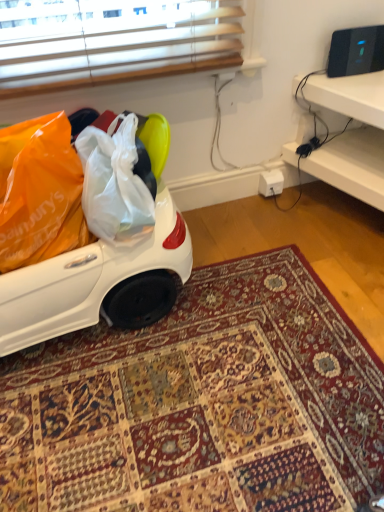
Question: Should I look upward or downward to see carpeted rug at center?

Choices:
 (A) down
 (B) up

Answer: (A)

Question: Does carpeted rug at center lie in front of white plastic desk at right?

Choices:
 (A) yes
 (B) no

Answer: (A)

Question: Is carpeted rug at center in contact with white plastic desk at right?

Choices:
 (A) no
 (B) yes

Answer: (A)

Question: Is there a large distance between carpeted rug at center and white plastic desk at right?

Choices:
 (A) yes
 (B) no

Answer: (B)

Question: Is carpeted rug at center bigger than white plastic desk at right?

Choices:
 (A) no
 (B) yes

Answer: (A)

Question: Could white plastic desk at right be considered to be inside carpeted rug at center?

Choices:
 (A) yes
 (B) no

Answer: (B)

Question: From a real-world perspective, is carpeted rug at center on white plastic desk at right?

Choices:
 (A) yes
 (B) no

Answer: (B)

Question: Would you say carpeted rug at center is part of white plastic desk at right's contents?

Choices:
 (A) yes
 (B) no

Answer: (B)

Question: From the image's perspective, is white plastic desk at right on carpeted rug at center?

Choices:
 (A) yes
 (B) no

Answer: (A)

Question: Considering the relative positions of white plastic desk at right and carpeted rug at center in the image provided, is white plastic desk at right to the right of carpeted rug at center from the viewer's perspective?

Choices:
 (A) no
 (B) yes

Answer: (B)

Question: Can you confirm if white plastic desk at right is wider than carpeted rug at center?

Choices:
 (A) yes
 (B) no

Answer: (B)

Question: Does white plastic desk at right touch carpeted rug at center?

Choices:
 (A) no
 (B) yes

Answer: (A)

Question: Considering the relative sizes of white plastic desk at right and carpeted rug at center in the image provided, is white plastic desk at right bigger than carpeted rug at center?

Choices:
 (A) yes
 (B) no

Answer: (A)

Question: Is point (21, 450) positioned closer to the camera than point (352, 192)?

Choices:
 (A) closer
 (B) farther

Answer: (A)